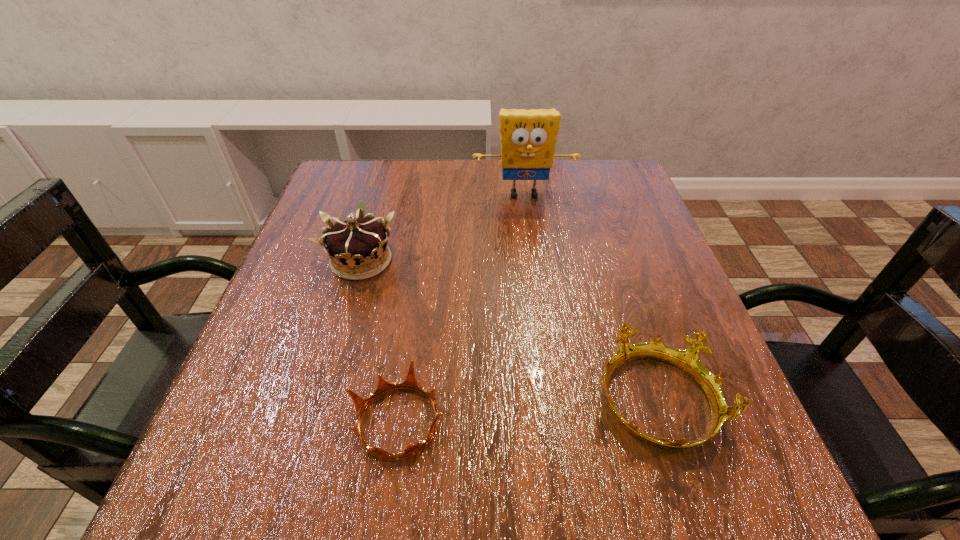
In the image, there is a desktop. At what (x,y) coordinates should I click in order to perform the action: click on free region at the right edge. Please return your answer as a coordinate pair (x, y). Looking at the image, I should click on (624, 256).

Locate an element on the screen. The image size is (960, 540). vacant space at the far left corner of the desktop is located at coordinates [x=337, y=163].

Locate an element on the screen. blank space at the far right corner of the desktop is located at coordinates coord(622,193).

Locate an element on the screen. empty space that is in between the tallest object and the third shortest object is located at coordinates point(443,227).

The image size is (960, 540). In order to click on free area in between the second tallest crown and the second farthest object in this screenshot , I will do `click(509, 331)`.

This screenshot has height=540, width=960. Find the location of `empty space that is in between the shortest crown and the third tallest object`. empty space that is in between the shortest crown and the third tallest object is located at coordinates (527, 412).

Where is `vacant space in between the rightmost crown and the sponge`? The width and height of the screenshot is (960, 540). vacant space in between the rightmost crown and the sponge is located at coordinates (590, 298).

The width and height of the screenshot is (960, 540). I want to click on free point between the second tallest object and the third tallest object, so click(509, 331).

I want to click on vacant space that's between the shortest object and the tallest crown, so click(x=380, y=341).

The height and width of the screenshot is (540, 960). I want to click on free spot between the shortest object and the sponge, so click(461, 308).